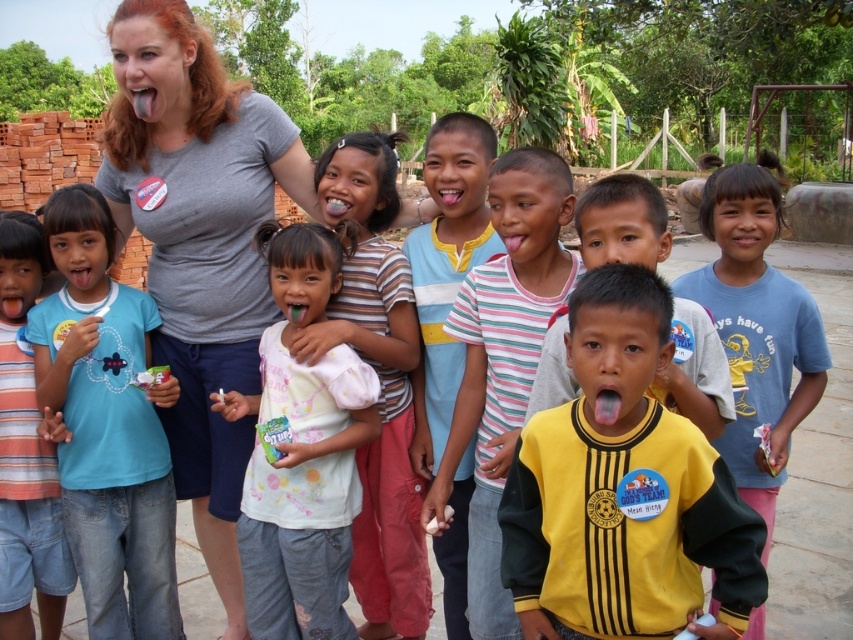
You are a photographer trying to capture a photo of the blue cotton shirt at left and the yellow jersey at center. Based on their positions, which one should you focus on first if you want to ensure both are in the frame without moving the camera?

The blue cotton shirt at left is higher than the yellow jersey at center, so you should focus on the blue cotton shirt at left first to ensure both are in the frame without moving the camera.

You are a photographer trying to capture a group photo of the children. You notice the blue cotton shirt at left and the white cotton shirt at center. Which child should you ask to move closer to make the shirts appear similar in size in the photo?

The blue cotton shirt at left occupies less space than the white cotton shirt at center, so you should ask the child wearing the blue cotton shirt at left to move closer to the camera to make them appear larger and balance the sizes.

You are organizing a clothing donation drive and need to sort shirts by size. You find two shirts in the center of the pile, a striped cotton shirt at center and a blue cotton shirt at center. Which one should you place in the small size bin?

The striped cotton shirt at center has a smaller size compared to blue cotton shirt at center, so it should be placed in the small size bin.